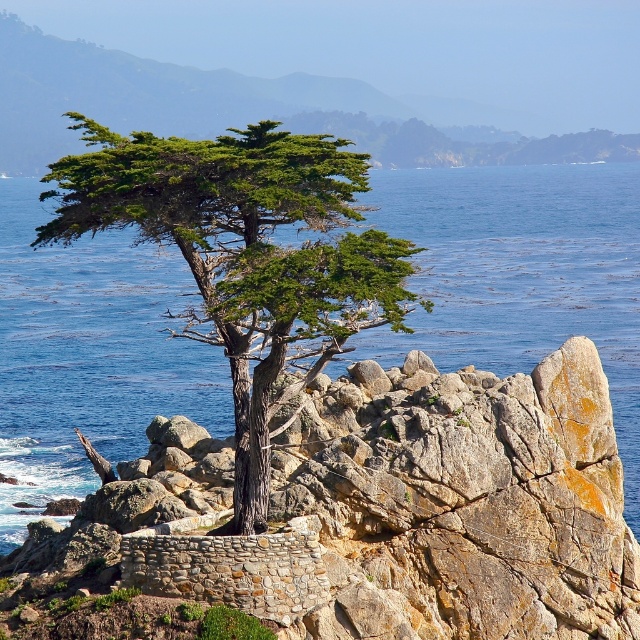
Question: Among these objects, which one is nearest to the camera?

Choices:
 (A) rustic stone wall at center
 (B) green textured cypress tree at center

Answer: (B)

Question: Which point appears farthest from the camera in this image?

Choices:
 (A) (433, 564)
 (B) (202, 218)

Answer: (A)

Question: Is rustic stone wall at center wider than green textured cypress tree at center?

Choices:
 (A) no
 (B) yes

Answer: (A)

Question: Among these points, which one is nearest to the camera?

Choices:
 (A) (307, 276)
 (B) (616, 577)

Answer: (A)

Question: Is rustic stone wall at center smaller than green textured cypress tree at center?

Choices:
 (A) no
 (B) yes

Answer: (B)

Question: Is rustic stone wall at center in front of green textured cypress tree at center?

Choices:
 (A) yes
 (B) no

Answer: (B)